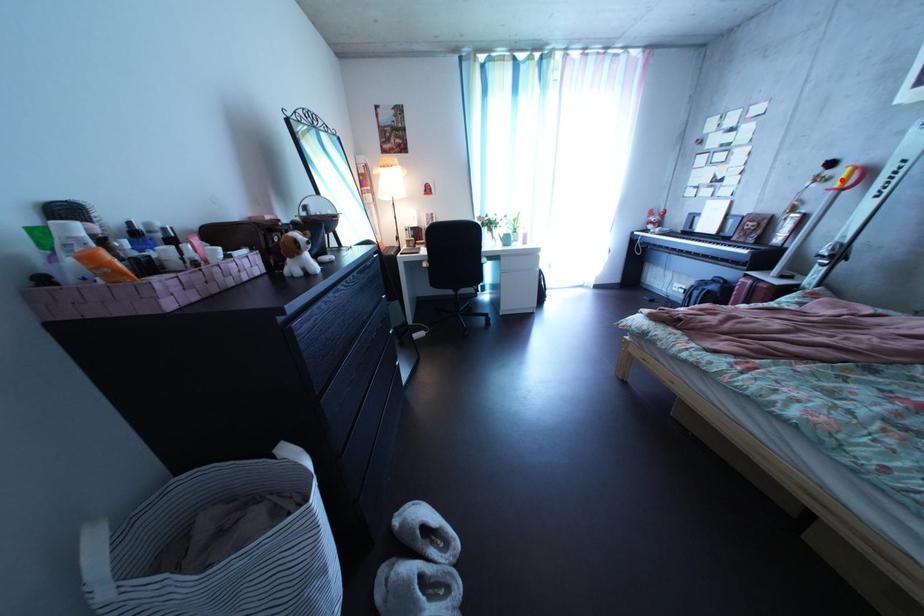
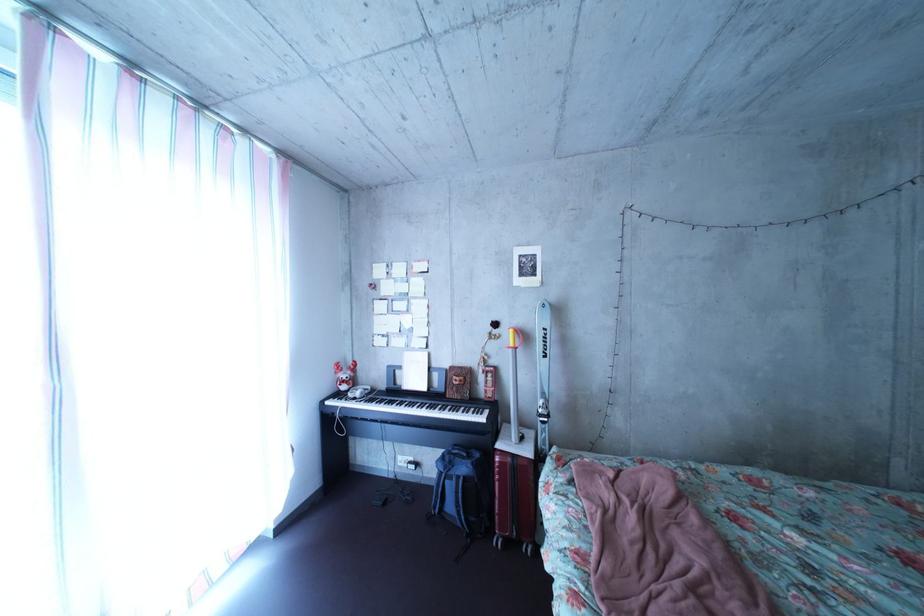
In the second image, find the point that corresponds to the highlighted location in the first image.

(509, 339)